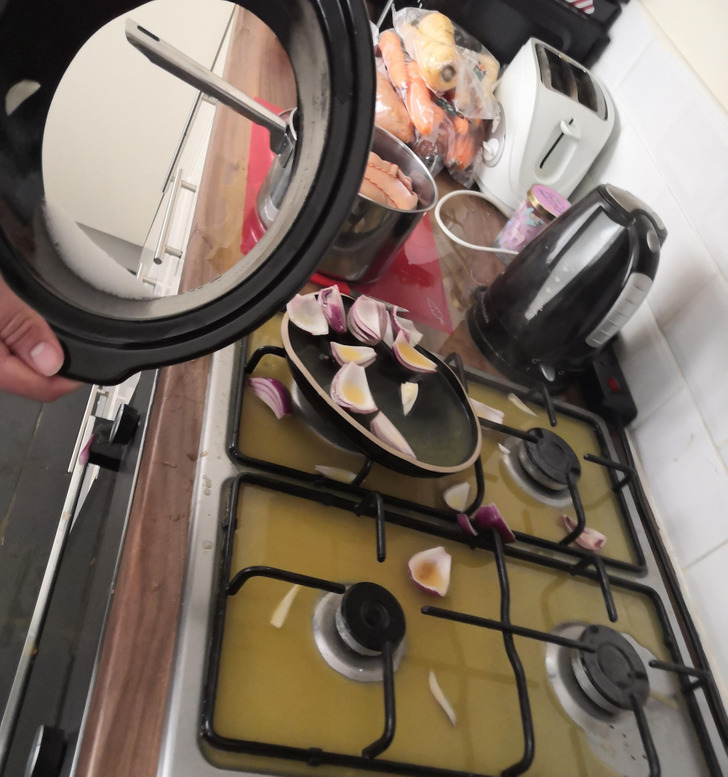
Where is `silver handle`? silver handle is located at coordinates (210, 85).